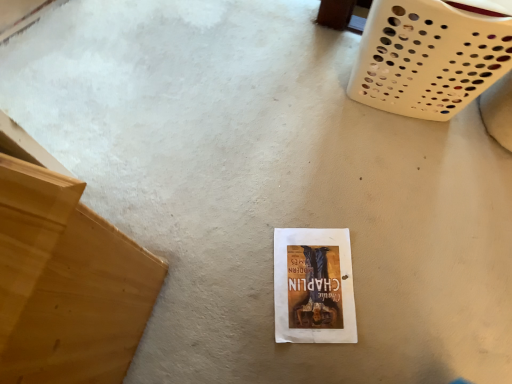
The width and height of the screenshot is (512, 384). Identify the location of vacant location below white paper at center (from a real-world perspective). (310, 278).